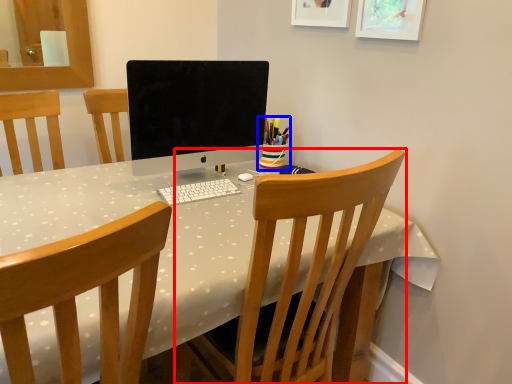
Question: Which of the following is the farthest to the observer, chair (highlighted by a red box) or stationery (highlighted by a blue box)?

Choices:
 (A) chair
 (B) stationery

Answer: (B)